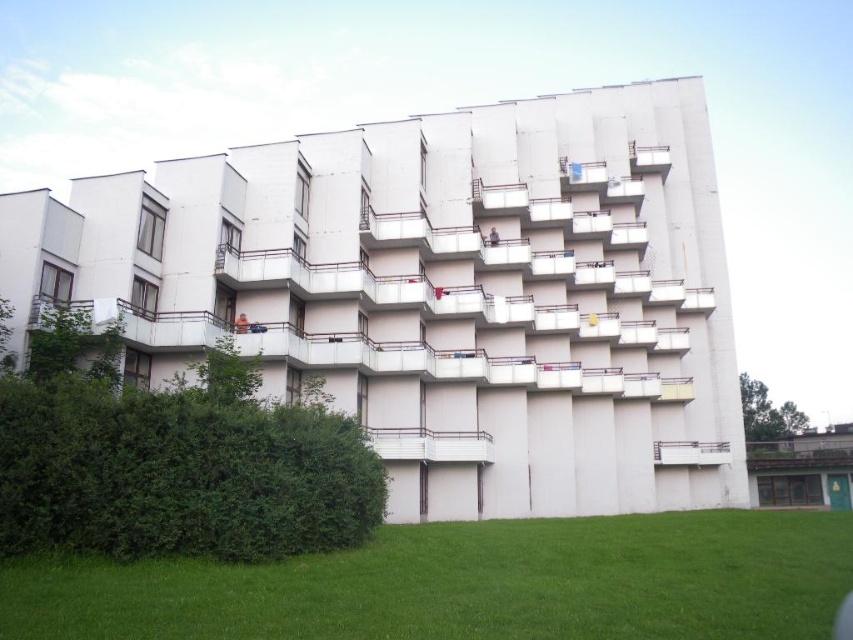
Is white metal balcony at center smaller than white concrete balcony at center?

No.

Is white metal balcony at center shorter than white concrete balcony at center?

Incorrect, white metal balcony at center's height does not fall short of white concrete balcony at center's.

What do you see at coordinates (431, 444) in the screenshot? The height and width of the screenshot is (640, 853). I see `white metal balcony at center` at bounding box center [431, 444].

Where is `white metal balcony at center`? The height and width of the screenshot is (640, 853). white metal balcony at center is located at coordinates (431, 444).

Is green leafy hedge at left further to the viewer compared to white concrete balcony at center?

No.

The width and height of the screenshot is (853, 640). Describe the element at coordinates (172, 458) in the screenshot. I see `green leafy hedge at left` at that location.

Where is `green leafy hedge at left`? This screenshot has height=640, width=853. green leafy hedge at left is located at coordinates (172, 458).

Measure the distance between green grass at lower center and camera.

They are 38.00 feet apart.

At what (x,y) coordinates should I click in order to perform the action: click on green grass at lower center. Please return your answer as a coordinate pair (x, y). This screenshot has width=853, height=640. Looking at the image, I should click on (469, 584).

This screenshot has width=853, height=640. What do you see at coordinates (469, 584) in the screenshot?
I see `green grass at lower center` at bounding box center [469, 584].

Identify the location of green grass at lower center. This screenshot has width=853, height=640. (469, 584).